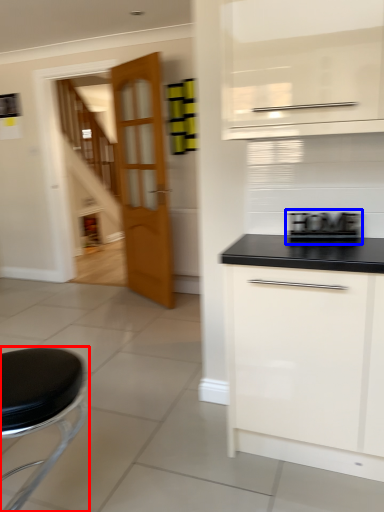
Question: Which object is closer to the camera taking this photo, furniture (highlighted by a red box) or appliance (highlighted by a blue box)?

Choices:
 (A) furniture
 (B) appliance

Answer: (A)